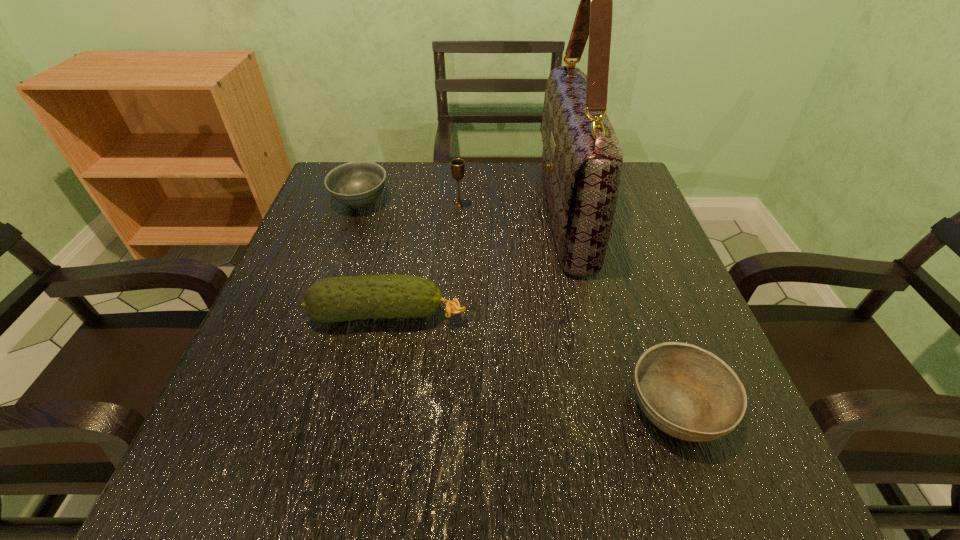
Where is `handbag situated at the right edge`? The image size is (960, 540). handbag situated at the right edge is located at coordinates (582, 159).

The height and width of the screenshot is (540, 960). In order to click on bowl that is at the right edge in this screenshot , I will do `click(689, 393)`.

Find the location of a particular element. This screenshot has width=960, height=540. object that is at the far left corner is located at coordinates (359, 183).

In order to click on object present at the far right corner in this screenshot , I will do pos(582,159).

Identify the location of object located at the near right corner. (689, 393).

At what (x,y) coordinates should I click in order to perform the action: click on free space at the far edge of the desktop. Please return your answer as a coordinate pair (x, y). Looking at the image, I should click on [450, 181].

Find the location of a particular element. This screenshot has width=960, height=540. blank area at the near edge is located at coordinates (324, 457).

Locate an element on the screen. Image resolution: width=960 pixels, height=540 pixels. vacant region at the left edge is located at coordinates (270, 418).

In the image, there is a desktop. Where is `vacant space at the right edge`? This screenshot has height=540, width=960. vacant space at the right edge is located at coordinates (665, 300).

Locate an element on the screen. free region at the far left corner is located at coordinates (330, 168).